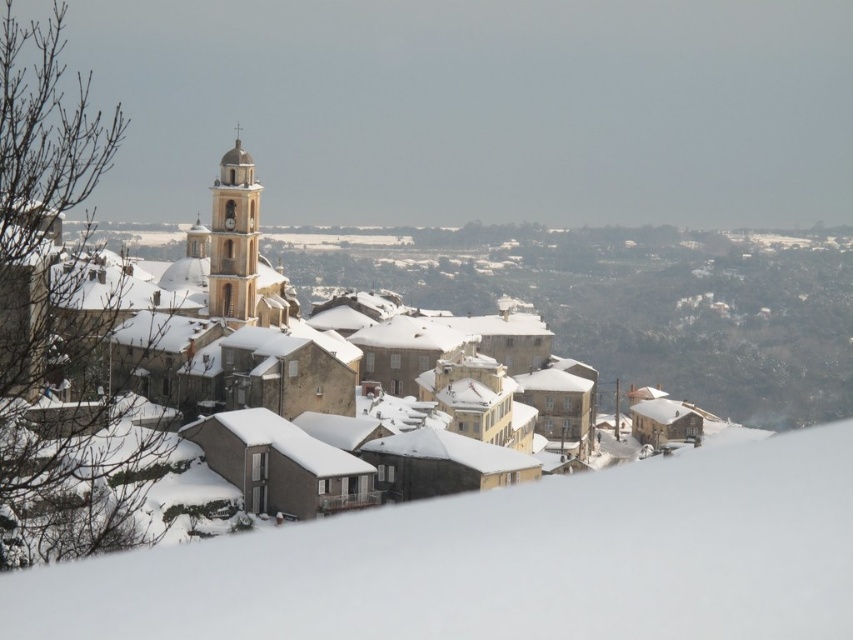
Question: Is snow-covered stone village at center thinner than smooth stone bell tower at center?

Choices:
 (A) no
 (B) yes

Answer: (A)

Question: Which point is farther from the camera taking this photo?

Choices:
 (A) (253, 246)
 (B) (303, 330)

Answer: (B)

Question: Can you confirm if snow-covered stone village at center is wider than smooth stone bell tower at center?

Choices:
 (A) no
 (B) yes

Answer: (B)

Question: Is snow-covered stone village at center below smooth stone bell tower at center?

Choices:
 (A) no
 (B) yes

Answer: (B)